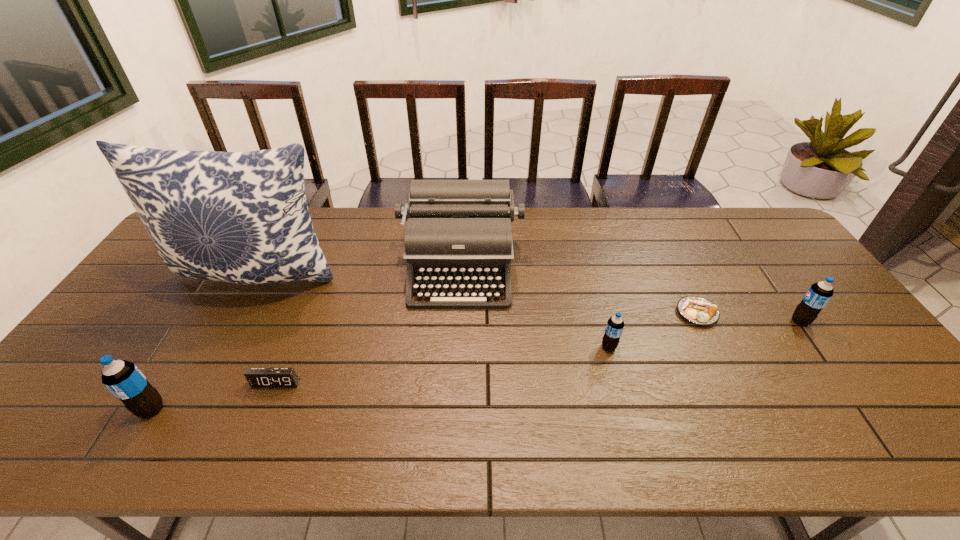
Find the location of a particular element. This screenshot has width=960, height=540. alarm clock that is at the near edge is located at coordinates tap(257, 377).

Find the location of a particular element. object at the left edge is located at coordinates (241, 217).

At what (x,y) coordinates should I click in order to perform the action: click on object positioned at the right edge. Please return your answer as a coordinate pair (x, y). Image resolution: width=960 pixels, height=540 pixels. Looking at the image, I should click on (819, 294).

You are a GUI agent. You are given a task and a screenshot of the screen. Output one action in this format:
    pyautogui.click(x=<x>, y=<y>)
    Task: Click on the free location at the far edge
    The height and width of the screenshot is (540, 960).
    Given the screenshot: What is the action you would take?
    pyautogui.click(x=680, y=227)

In the image, there is a desktop. Where is `vacant space at the near edge`? Image resolution: width=960 pixels, height=540 pixels. vacant space at the near edge is located at coordinates (373, 405).

Identify the location of free location at the left edge. (x=152, y=316).

This screenshot has width=960, height=540. In the image, there is a desktop. In order to click on blank space at the right edge in this screenshot , I will do `click(889, 375)`.

What are the coordinates of `vacant space at the far right corner of the desktop` in the screenshot? It's located at (723, 210).

The height and width of the screenshot is (540, 960). I want to click on vacant area that lies between the fourth object from left to right and the rightmost object, so click(x=631, y=294).

You are a GUI agent. You are given a task and a screenshot of the screen. Output one action in this format:
    pyautogui.click(x=<x>, y=<y>)
    Task: Click on the free point between the shortest object and the nearest object
    
    Given the screenshot: What is the action you would take?
    pyautogui.click(x=424, y=361)